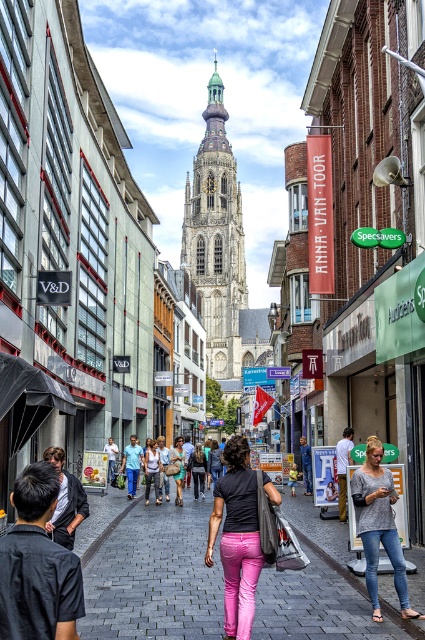
Does matte black shirt at center have a greater height compared to gray cotton shirt at center?

Yes, matte black shirt at center is taller than gray cotton shirt at center.

In the scene shown: Can you confirm if matte black shirt at center is shorter than gray cotton shirt at center?

Incorrect, matte black shirt at center's height does not fall short of gray cotton shirt at center's.

The width and height of the screenshot is (425, 640). What do you see at coordinates (237, 538) in the screenshot?
I see `matte black shirt at center` at bounding box center [237, 538].

Locate an element on the screen. The image size is (425, 640). matte black shirt at center is located at coordinates (237, 538).

Based on the photo, which is more to the right, matte black shirt at center or matte black dress at center?

Positioned to the right is matte black shirt at center.

Is matte black shirt at center positioned in front of matte black dress at center?

That is True.

What do you see at coordinates (237, 538) in the screenshot? The height and width of the screenshot is (640, 425). I see `matte black shirt at center` at bounding box center [237, 538].

Where is `matte black shirt at center`? matte black shirt at center is located at coordinates (237, 538).

Does black cotton shirt at center appear under matte black shirt at center?

Incorrect, black cotton shirt at center is not positioned below matte black shirt at center.

How distant is black cotton shirt at center from matte black shirt at center?

black cotton shirt at center and matte black shirt at center are 38.56 feet apart.

At what (x,y) coordinates should I click in order to perform the action: click on black cotton shirt at center. Please return your answer as a coordinate pair (x, y). Looking at the image, I should click on (37, 564).